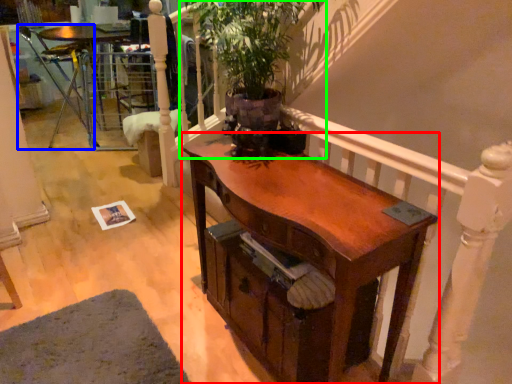
Question: Which object is positioned closest to desk (highlighted by a red box)? Select from armchair (highlighted by a blue box) and houseplant (highlighted by a green box).

Choices:
 (A) armchair
 (B) houseplant

Answer: (B)